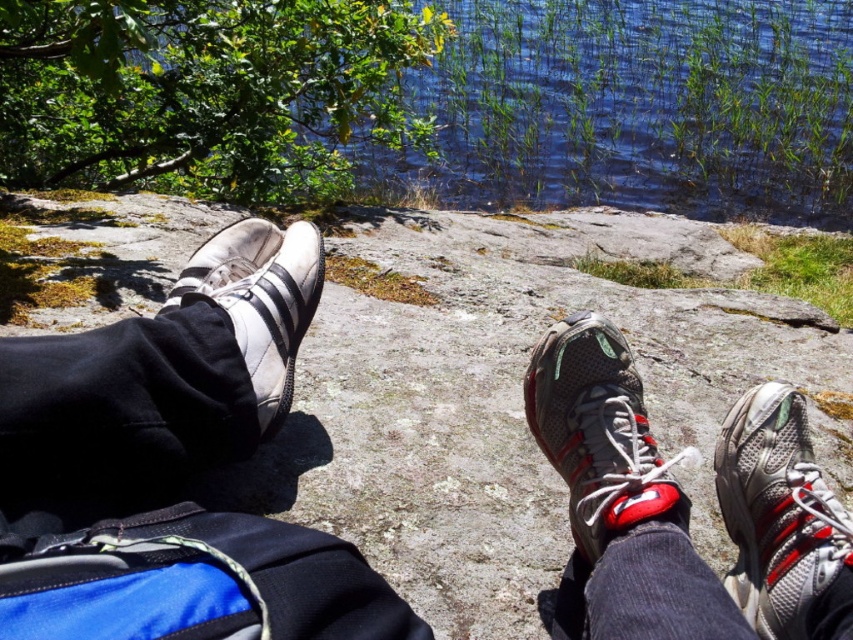
Question: Which object is positioned farthest from the gray mesh shoe at center?

Choices:
 (A) white leather shoe at left
 (B) white leather sneakers at lower center
 (C) silver mesh shoe at lower right

Answer: (A)

Question: Among these points, which one is farthest from the camera?

Choices:
 (A) (252, 380)
 (B) (202, 320)
 (C) (802, 529)

Answer: (A)

Question: Is white leather sneakers at lower center below gray mesh shoe at center?

Choices:
 (A) yes
 (B) no

Answer: (A)

Question: Does silver mesh shoe at lower right appear over gray mesh shoe at center?

Choices:
 (A) yes
 (B) no

Answer: (B)

Question: Is white leather sneakers at lower center wider than white leather shoe at left?

Choices:
 (A) yes
 (B) no

Answer: (A)

Question: Which point is farther from the camera taking this photo?

Choices:
 (A) (253, 248)
 (B) (819, 552)
 (C) (544, 381)
 (D) (32, 524)

Answer: (A)